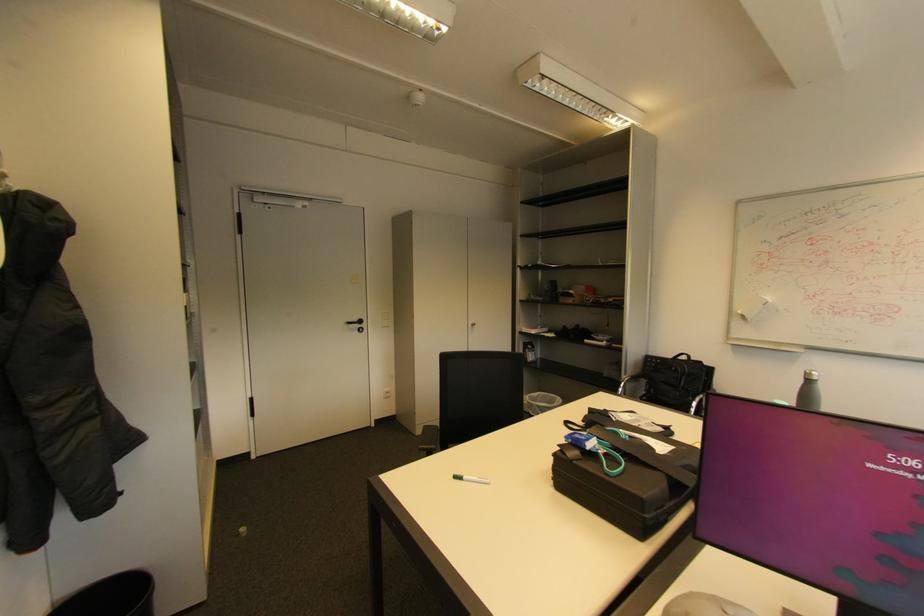
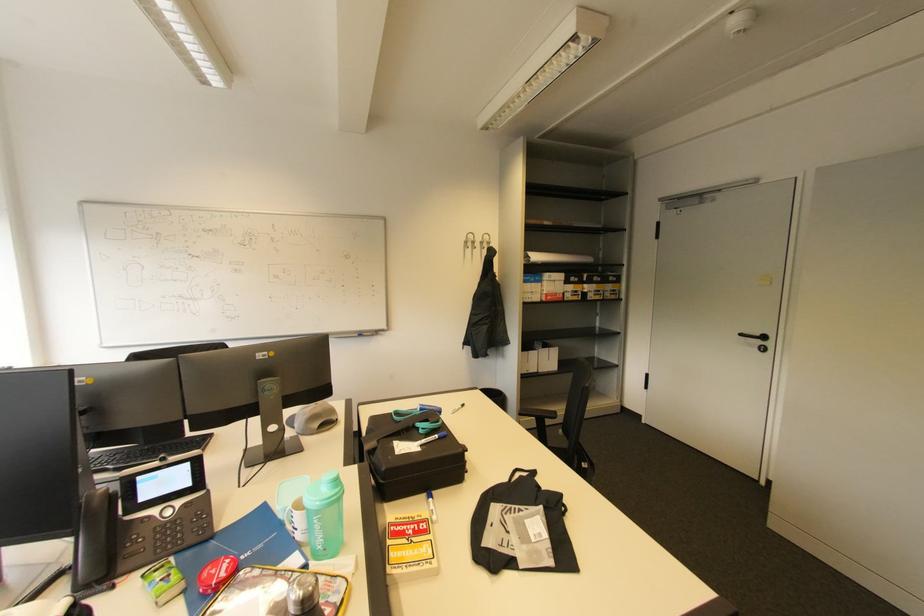
The point at (366, 322) is marked in the first image. Where is the corresponding point in the second image?

(769, 339)